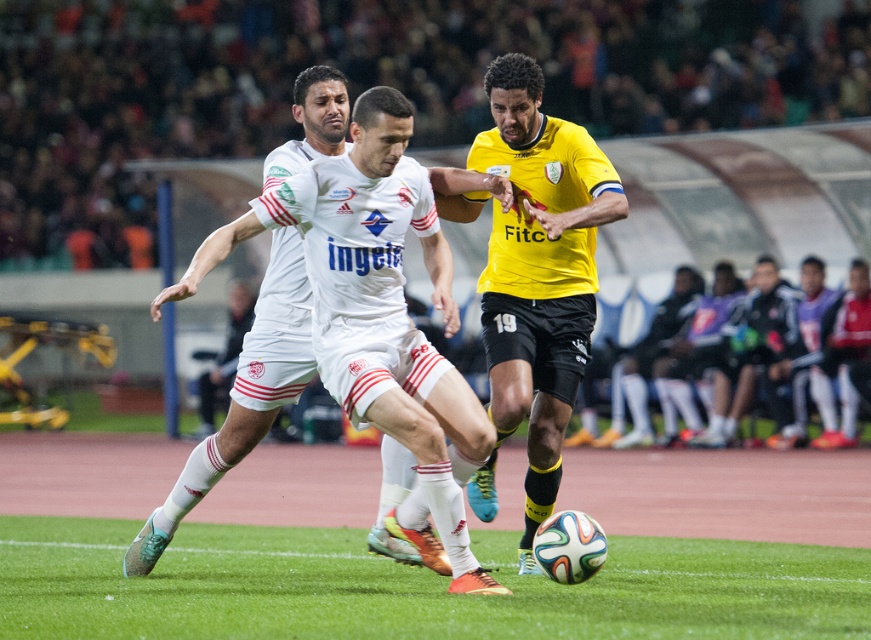
Which of these two, white matte jersey at center or yellow matte jersey at center, stands taller?

Standing taller between the two is yellow matte jersey at center.

Locate an element on the screen. The image size is (871, 640). white matte jersey at center is located at coordinates (379, 314).